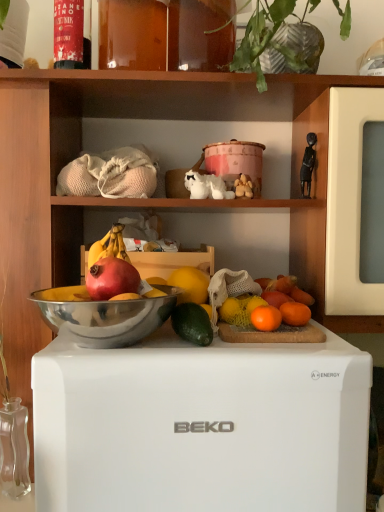
I want to click on unoccupied region to the right of green matte avocado at center, so click(303, 352).